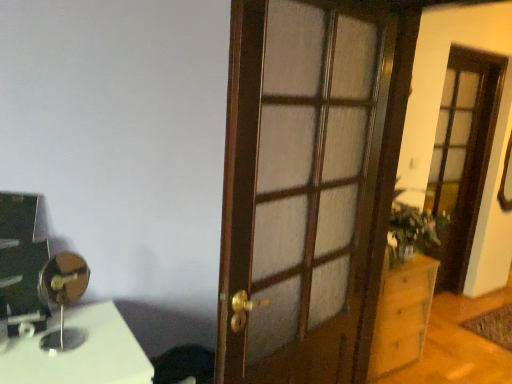
Question: Is green leafy plant at right touching wooden cabinet at right?

Choices:
 (A) no
 (B) yes

Answer: (A)

Question: Is green leafy plant at right closer to the viewer compared to wooden cabinet at right?

Choices:
 (A) yes
 (B) no

Answer: (B)

Question: Does green leafy plant at right have a larger size compared to wooden cabinet at right?

Choices:
 (A) no
 (B) yes

Answer: (A)

Question: Is green leafy plant at right shorter than wooden cabinet at right?

Choices:
 (A) yes
 (B) no

Answer: (A)

Question: Could you tell me if green leafy plant at right is turned towards wooden cabinet at right?

Choices:
 (A) yes
 (B) no

Answer: (B)

Question: Would you say green leafy plant at right is to the left or to the right of wooden door at center in the picture?

Choices:
 (A) left
 (B) right

Answer: (B)

Question: From the image's perspective, is green leafy plant at right above or below wooden door at center?

Choices:
 (A) above
 (B) below

Answer: (B)

Question: Based on their sizes in the image, would you say green leafy plant at right is bigger or smaller than wooden door at center?

Choices:
 (A) big
 (B) small

Answer: (B)

Question: Considering the positions of green leafy plant at right and wooden door at center in the image, is green leafy plant at right wider or thinner than wooden door at center?

Choices:
 (A) wide
 (B) thin

Answer: (A)

Question: Considering the positions of wooden screen door at right and wooden door at center in the image, is wooden screen door at right wider or thinner than wooden door at center?

Choices:
 (A) wide
 (B) thin

Answer: (A)

Question: From the image's perspective, relative to wooden door at center, is wooden screen door at right above or below?

Choices:
 (A) above
 (B) below

Answer: (A)

Question: Is point (435, 187) positioned closer to the camera than point (330, 180)?

Choices:
 (A) closer
 (B) farther

Answer: (B)

Question: From a real-world perspective, relative to wooden door at center, is wooden screen door at right vertically above or below?

Choices:
 (A) below
 (B) above

Answer: (A)

Question: From the image's perspective, is wooden cabinet at right positioned above or below green leafy plant at right?

Choices:
 (A) below
 (B) above

Answer: (A)

Question: Is point (394, 296) closer or farther from the camera than point (396, 259)?

Choices:
 (A) closer
 (B) farther

Answer: (B)